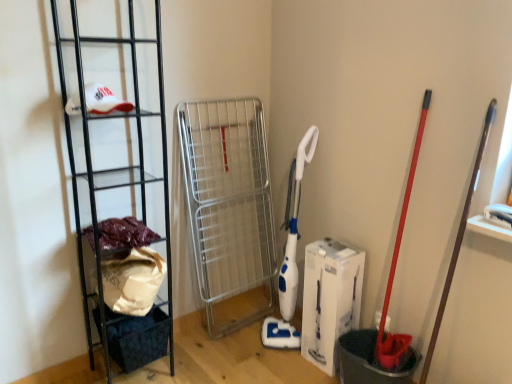
Question: In the image, is fuzzy fabric at left positioned in front of or behind dark blue fabric basket at lower left?

Choices:
 (A) behind
 (B) front

Answer: (B)

Question: Is fuzzy fabric at left taller or shorter than dark blue fabric basket at lower left?

Choices:
 (A) short
 (B) tall

Answer: (A)

Question: Estimate the real-world distances between objects in this image. Which object is farther from the black metal rack at left?

Choices:
 (A) fuzzy fabric at left
 (B) white cardboard box at center
 (C) dark blue fabric basket at lower left

Answer: (B)

Question: Which object is positioned farthest from the dark blue fabric basket at lower left?

Choices:
 (A) black metal rack at left
 (B) fuzzy fabric at left
 (C) white cardboard box at center

Answer: (C)